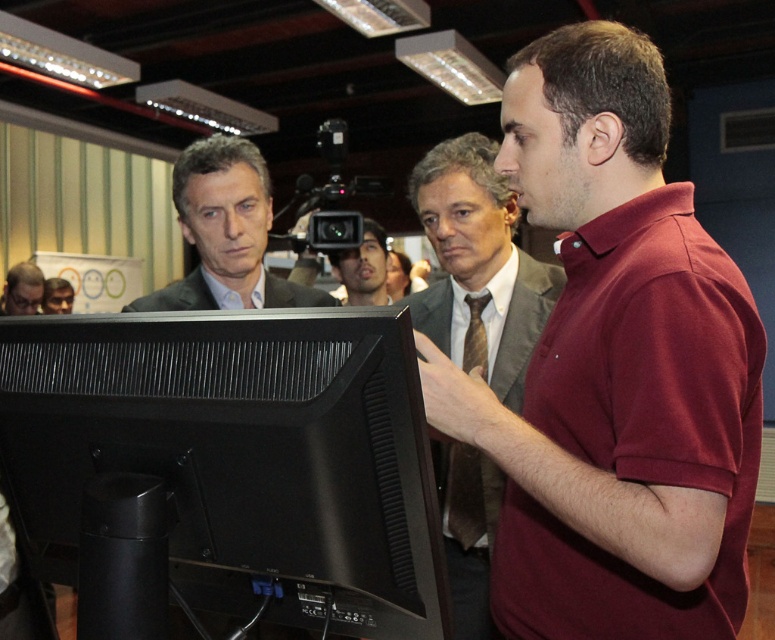
You are organizing a presentation and need to ensure that the black matte monitor at center and the matte black suit at center are both visible to the audience. Based on their sizes, which object should be placed closer to the front to ensure visibility?

The black matte monitor at center should be placed closer to the front because it occupies less space than the matte black suit at center, making it smaller and potentially harder to see from a distance.

You are a security guard in this room and need to move from the maroon cotton polo shirt at right to the matte gray suit at center. Can you walk directly between them without needing to detour around any obstacles?

The distance between the maroon cotton polo shirt at right and the matte gray suit at center is 20.82 inches, so you cannot walk directly between them without detouring around obstacles because the space is too narrow for a person to pass through comfortably.

You are a photographer setting up for a group photo. You need to position two markers at the coordinates point (374, 227) and point (67, 291). Which marker should you place closer to the camera to ensure proper focus?

The point (374, 227) should be placed closer to the camera since it is closer to the camera than point 0.456, 0.088 according to the description.